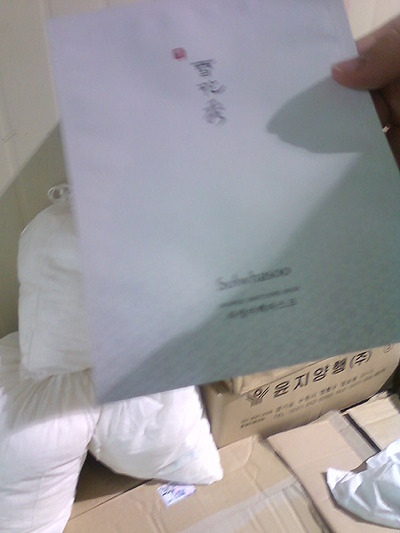
Where is `piece of paper`? This screenshot has width=400, height=533. piece of paper is located at coordinates (147, 245).